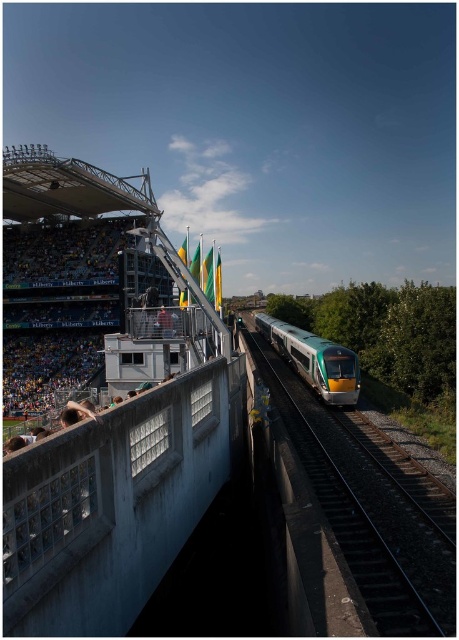
Question: Which object appears farthest from the camera in this image?

Choices:
 (A) green metallic train track at center
 (B) green metallic train at center

Answer: (B)

Question: Where is green metallic train track at center located in relation to green metallic train at center in the image?

Choices:
 (A) below
 (B) above

Answer: (A)

Question: Among these objects, which one is farthest from the camera?

Choices:
 (A) green metallic train track at center
 (B) green metallic train at center

Answer: (B)

Question: Does green metallic train track at center lie behind green metallic train at center?

Choices:
 (A) yes
 (B) no

Answer: (B)

Question: Is green metallic train track at center bigger than green metallic train at center?

Choices:
 (A) yes
 (B) no

Answer: (B)